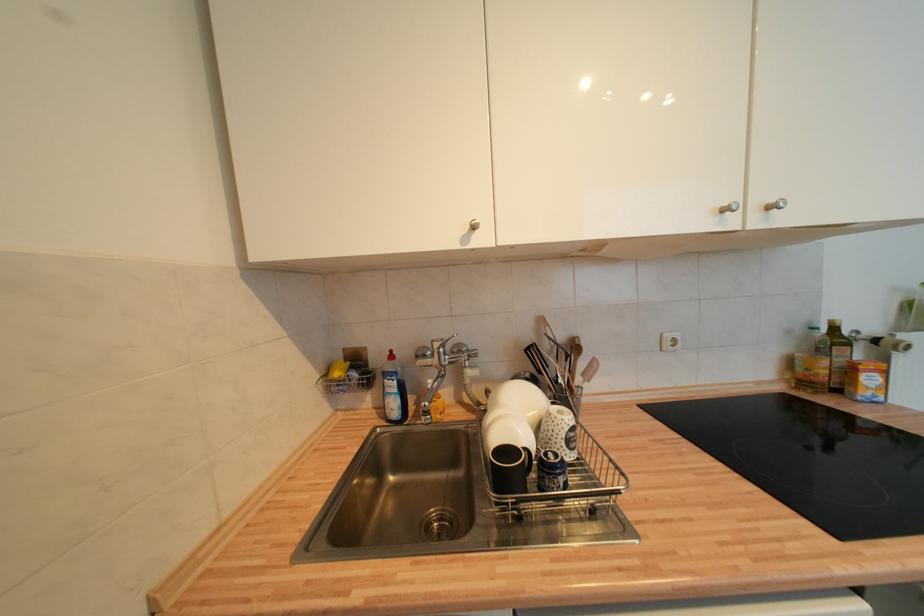
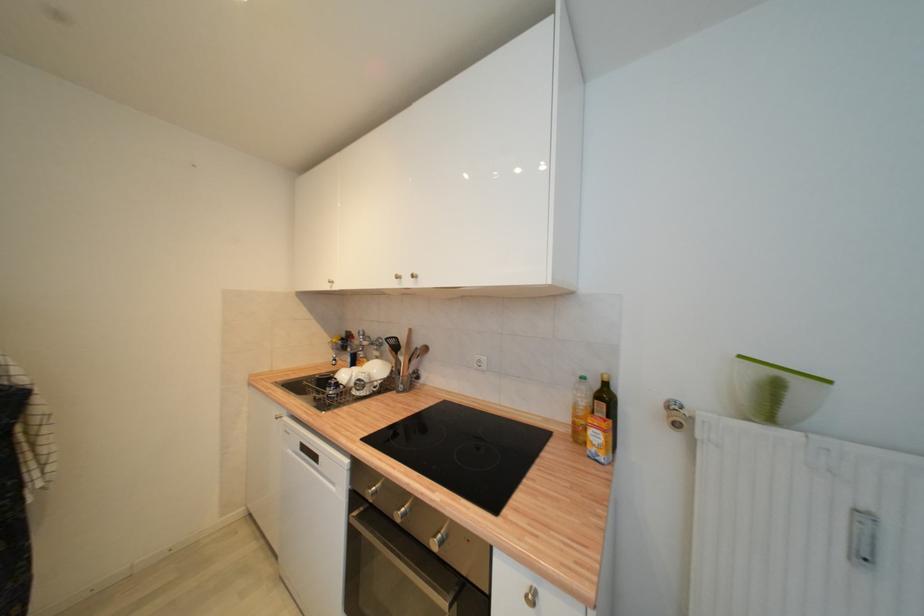
Locate, in the second image, the point that corresponds to (x=819, y=331) in the first image.

(586, 379)